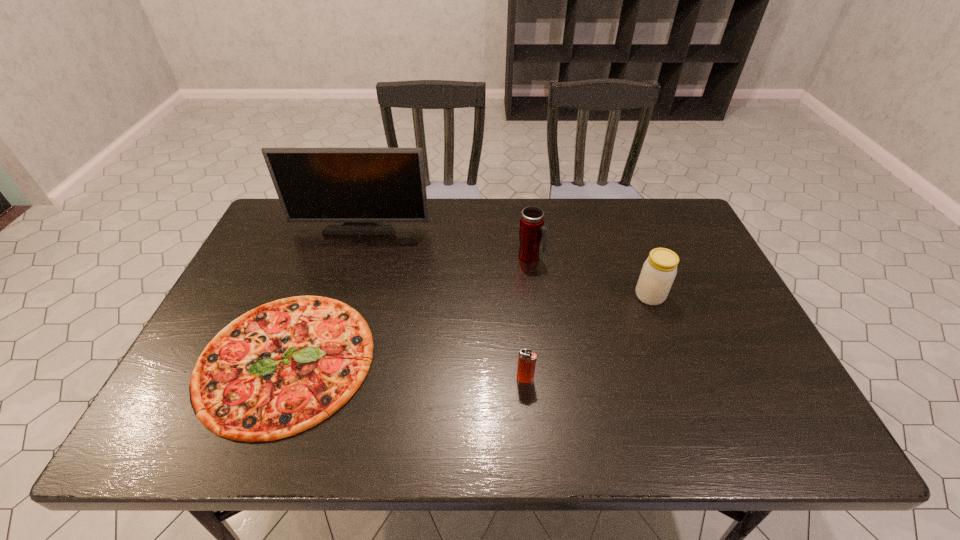
In the image, there is a desktop. Where is `vacant space at the right edge`? vacant space at the right edge is located at coordinates point(687,310).

Locate an element on the screen. The width and height of the screenshot is (960, 540). vacant space at the far right corner is located at coordinates (660, 214).

Locate an element on the screen. The width and height of the screenshot is (960, 540). free space at the near right corner of the desktop is located at coordinates (791, 438).

This screenshot has width=960, height=540. Identify the location of free spot between the rightmost object and the second farthest object. (590, 276).

Identify the location of free space that is in between the thermos bottle and the shortest object. This screenshot has width=960, height=540. (408, 308).

Where is `vacant region between the monitor and the pizza`? The image size is (960, 540). vacant region between the monitor and the pizza is located at coordinates (324, 293).

You are a GUI agent. You are given a task and a screenshot of the screen. Output one action in this format:
    pyautogui.click(x=<x>, y=<y>)
    Task: Click on the vacant space that is in between the pizza and the tallest object
    The width and height of the screenshot is (960, 540).
    Given the screenshot: What is the action you would take?
    [324, 293]

Locate an element on the screen. The height and width of the screenshot is (540, 960). free point between the tallest object and the pizza is located at coordinates (324, 293).

Identify the location of free space between the farthest object and the fourth tallest object. (444, 302).

This screenshot has width=960, height=540. I want to click on free space between the thermos bottle and the farthest object, so click(x=445, y=241).